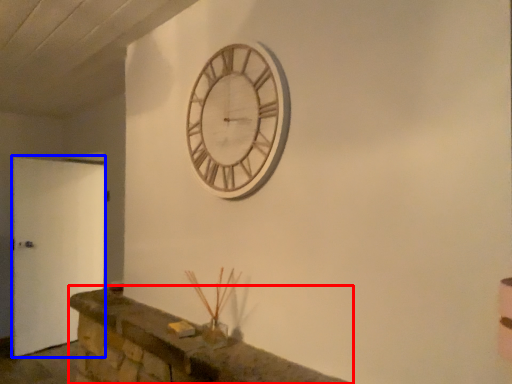
Question: Which object is closer to the camera taking this photo, mantle (highlighted by a red box) or door (highlighted by a blue box)?

Choices:
 (A) mantle
 (B) door

Answer: (A)